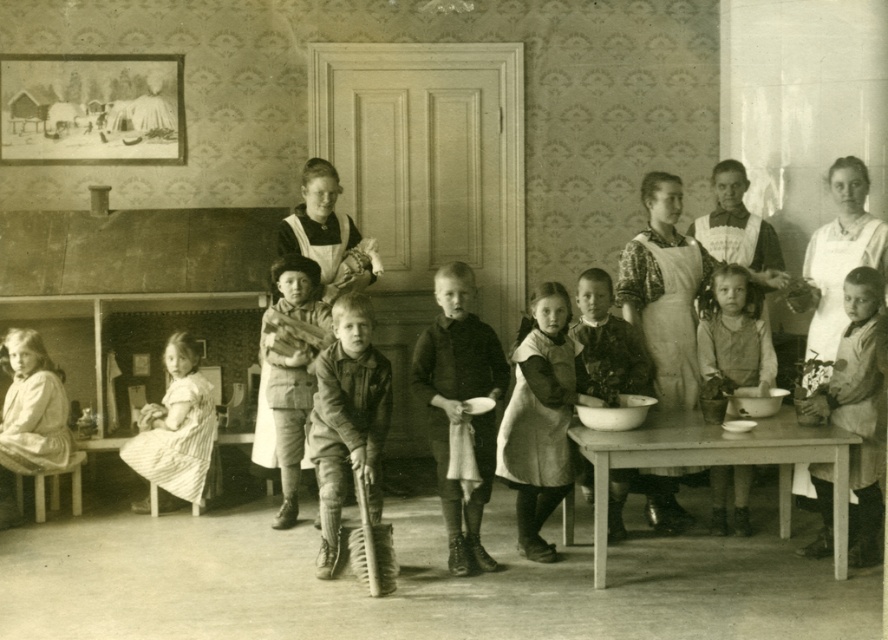
You are a tailor observing the light brown fabric dress at center and the matte apron child at center in the image. Which item has a narrower width?

The light brown fabric dress at center is thinner than the matte apron child at center, so the light brown fabric dress at center has a narrower width.

You are a tailor trying to fit a customer for a new outfit. You have a rough leather jacket at center and a dark brown fabric dress at center in front of you. Which item requires more space to handle due to its width?

The rough leather jacket at center might be wider than dark brown fabric dress at center, so the rough leather jacket at center requires more space to handle due to its width.